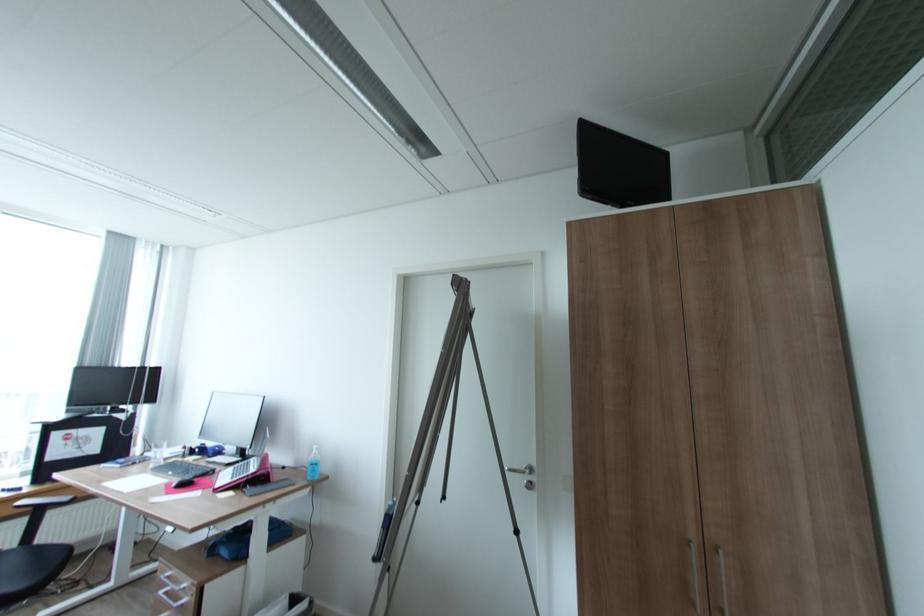
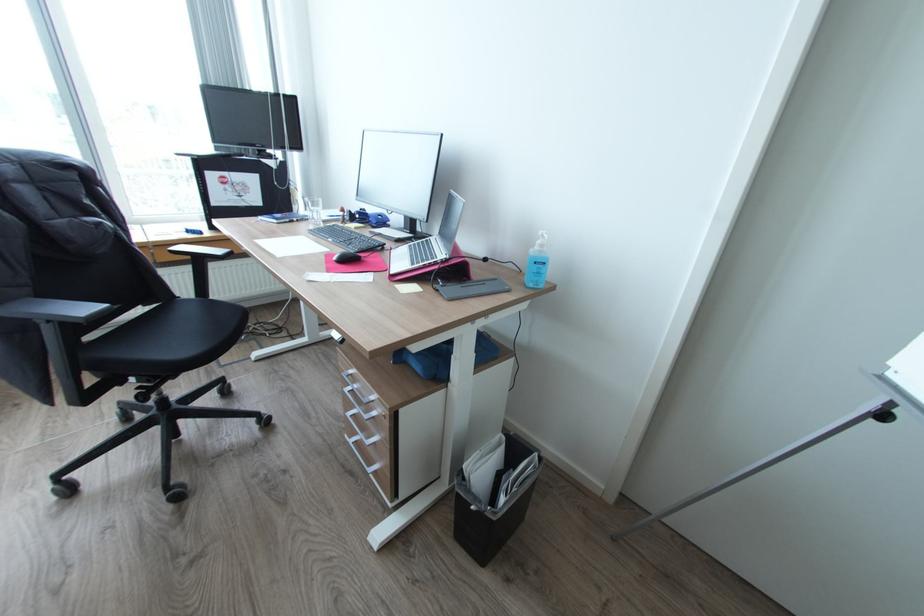
The point at (201, 450) is marked in the first image. Where is the corresponding point in the second image?

(362, 216)